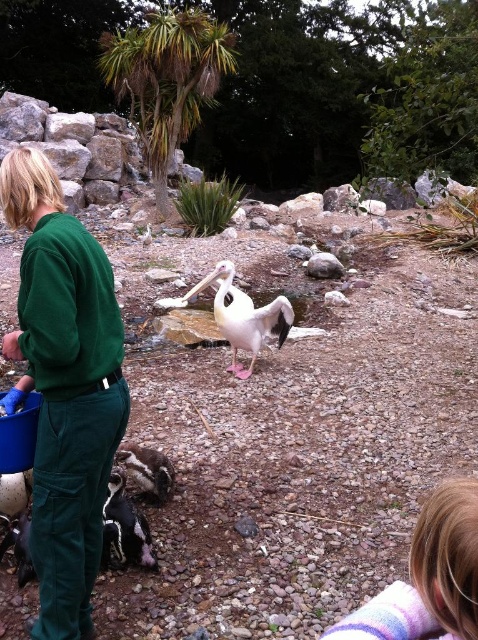
Between white matte pelican at center and black and white speckled bird at lower left, which one is positioned higher?

white matte pelican at center is above.

Identify the location of white matte pelican at center. The image size is (478, 640). (243, 316).

Identify the location of white matte pelican at center. (243, 316).

Measure the distance between point (x=214, y=307) and camera.

A distance of 5.45 meters exists between point (x=214, y=307) and camera.

What are the coordinates of `white matte pelican at center` in the screenshot? It's located at (243, 316).

Between black glossy penguin at lower left and black and white speckled bird at lower left, which one has more height?

Standing taller between the two is black glossy penguin at lower left.

Measure the distance from black glossy penguin at lower left to black and white speckled bird at lower left.

black glossy penguin at lower left and black and white speckled bird at lower left are 12.38 inches apart from each other.

Which is behind, point (138, 538) or point (117, 461)?

The point (117, 461) is behind.

Identify the location of black glossy penguin at lower left. (125, 529).